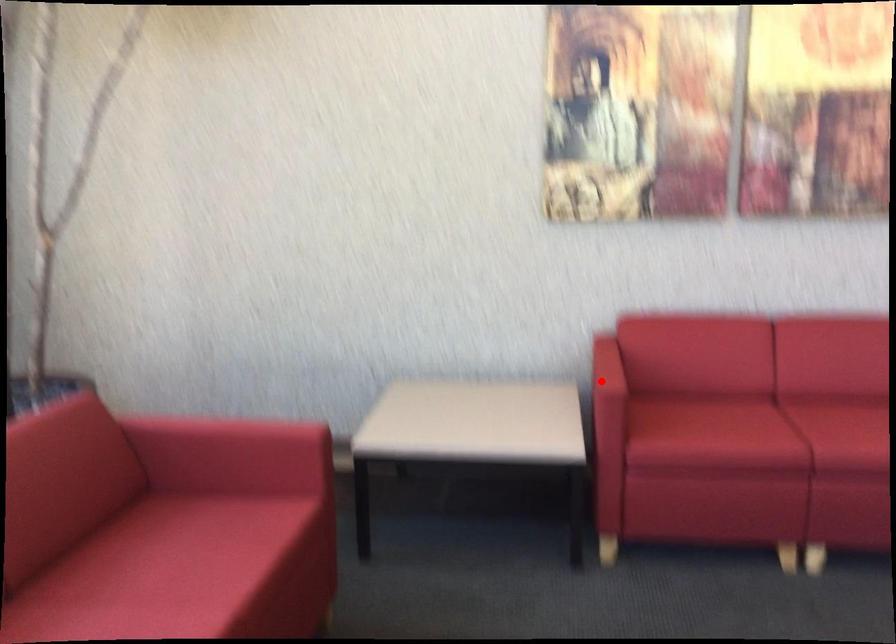
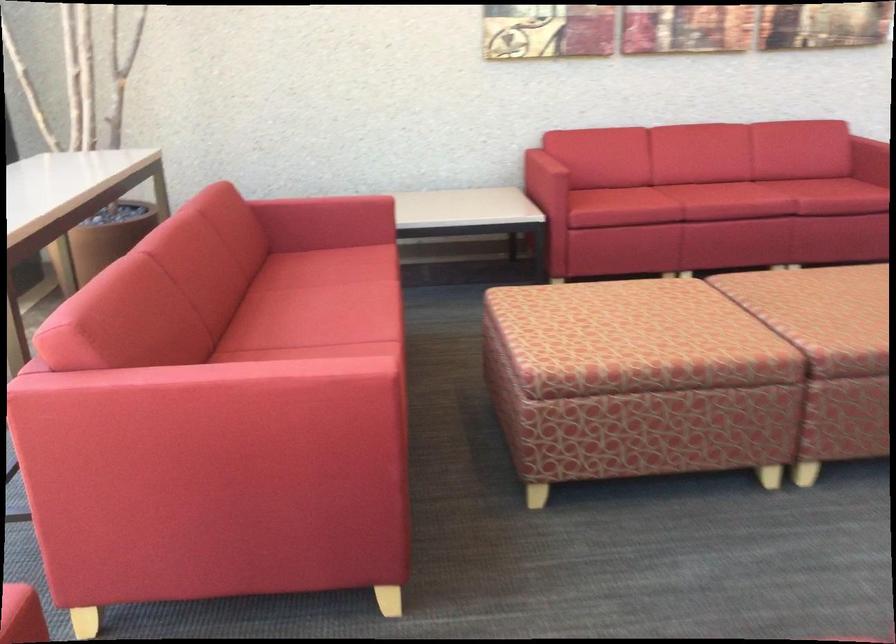
Question: I am providing you with two images of the same scene from different viewpoints. Image1 has a red point marked. In image2, the corresponding 3D location appears at what relative position? Reply with the corresponding letter.

Choices:
 (A) Closer
 (B) Farther

Answer: (B)